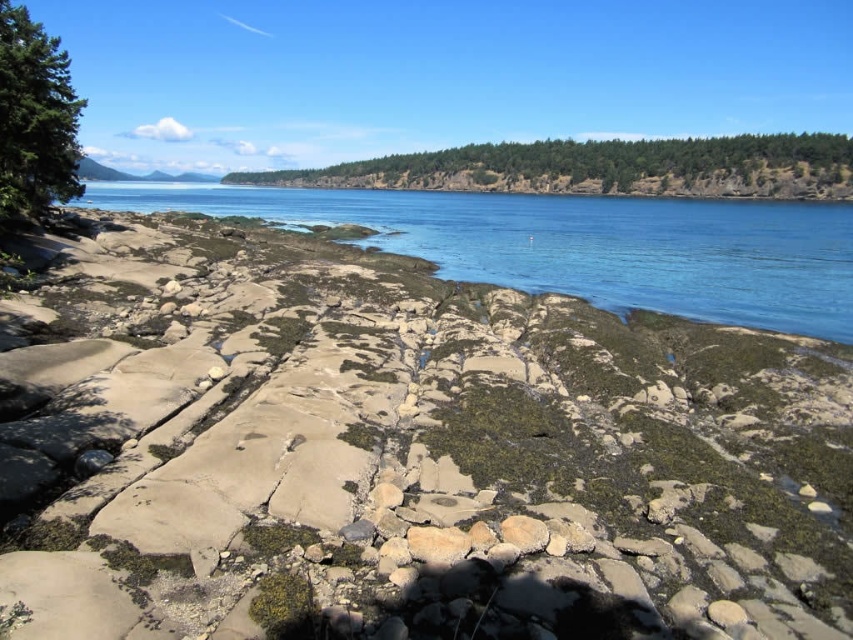
Does smooth sandstone rocks at center have a greater height compared to blue water at center?

No.

Between smooth sandstone rocks at center and blue water at center, which one is positioned lower?

smooth sandstone rocks at center is lower down.

Who is more forward, (737, 637) or (476, 198)?

Point (737, 637) is in front.

This screenshot has width=853, height=640. I want to click on smooth sandstone rocks at center, so pos(398,451).

Does blue water at center come in front of green matte tree at upper left?

That is False.

Can you confirm if blue water at center is positioned to the right of green matte tree at upper left?

Indeed, blue water at center is positioned on the right side of green matte tree at upper left.

This screenshot has width=853, height=640. What are the coordinates of `blue water at center` in the screenshot? It's located at coord(577,244).

Locate an element on the screen. blue water at center is located at coordinates 577,244.

Does smooth sandstone rocks at center appear on the right side of green leafy forest at upper center?

In fact, smooth sandstone rocks at center is to the left of green leafy forest at upper center.

Is point (544, 634) in front of point (357, 163)?

Yes.

Image resolution: width=853 pixels, height=640 pixels. I want to click on smooth sandstone rocks at center, so click(398, 451).